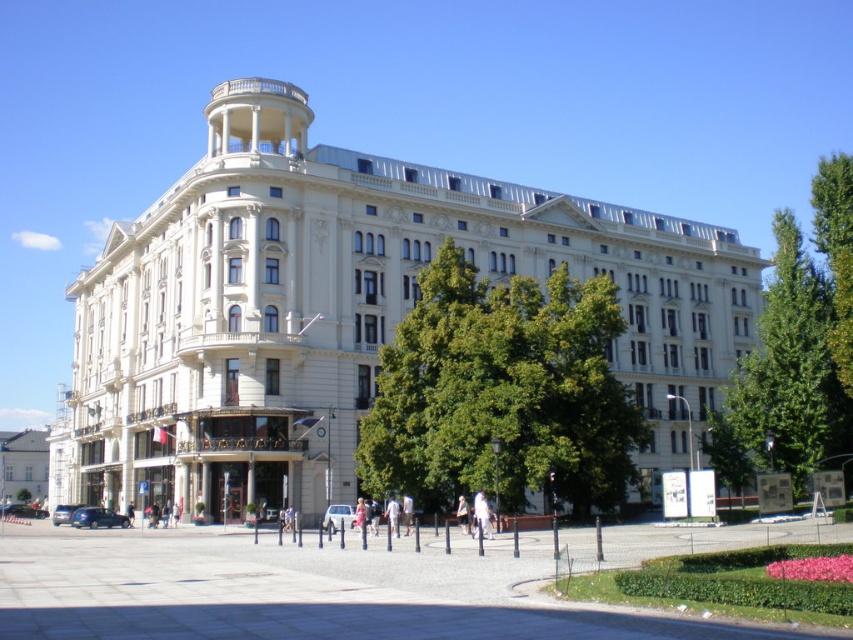
Question: Considering the real-world distances, which object is closest to the green leafy tree at right?

Choices:
 (A) green leafy tree at center
 (B) white glossy building at lower left
 (C) green textured tree at right
 (D) white stone building at center

Answer: (C)

Question: Does white stone building at center have a smaller size compared to green leafy tree at right?

Choices:
 (A) no
 (B) yes

Answer: (B)

Question: Which object is farther from the camera taking this photo?

Choices:
 (A) green leafy tree at right
 (B) green textured tree at right

Answer: (B)

Question: Does white stone building at center come behind green leafy tree at center?

Choices:
 (A) no
 (B) yes

Answer: (B)

Question: Is green leafy tree at right wider than white glossy building at lower left?

Choices:
 (A) no
 (B) yes

Answer: (B)

Question: Which object is closer to the camera taking this photo?

Choices:
 (A) white glossy building at lower left
 (B) green leafy tree at center

Answer: (B)